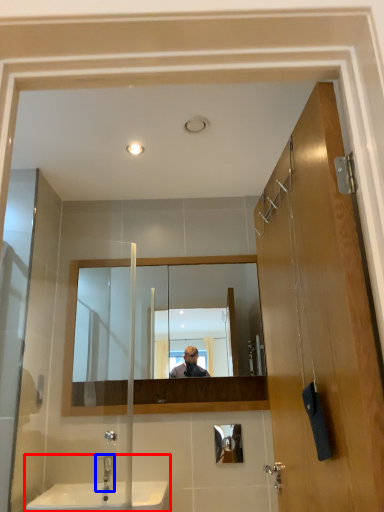
Question: Which point is closer to the camera, sink (highlighted by a red box) or tap (highlighted by a blue box)?

Choices:
 (A) sink
 (B) tap

Answer: (A)